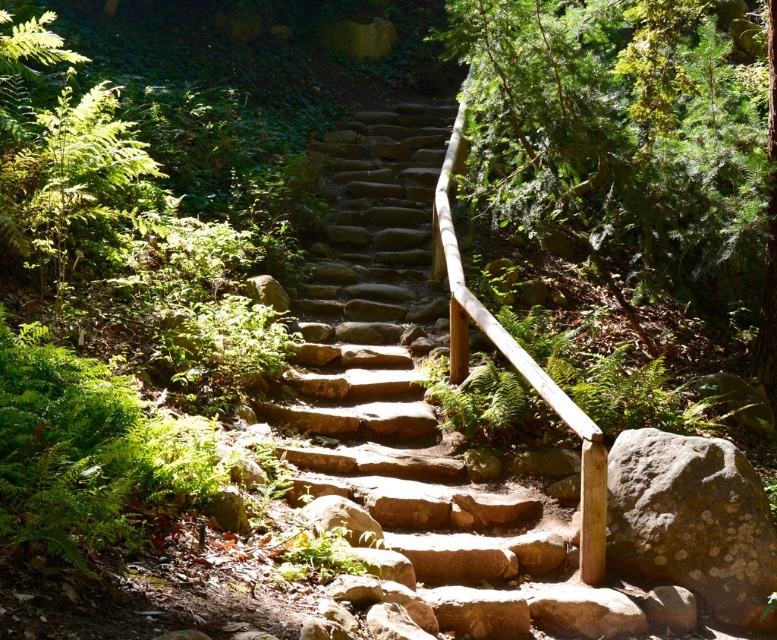
Question: Is natural stone stairs at center further to camera compared to gray rough rock at lower right?

Choices:
 (A) yes
 (B) no

Answer: (A)

Question: Which of the following is the farthest from the observer?

Choices:
 (A) gray rough rock at lower right
 (B) natural stone stairs at center

Answer: (B)

Question: Does natural stone stairs at center appear on the right side of gray rough rock at lower right?

Choices:
 (A) yes
 (B) no

Answer: (B)

Question: Can you confirm if natural stone stairs at center is smaller than gray rough rock at lower right?

Choices:
 (A) no
 (B) yes

Answer: (B)